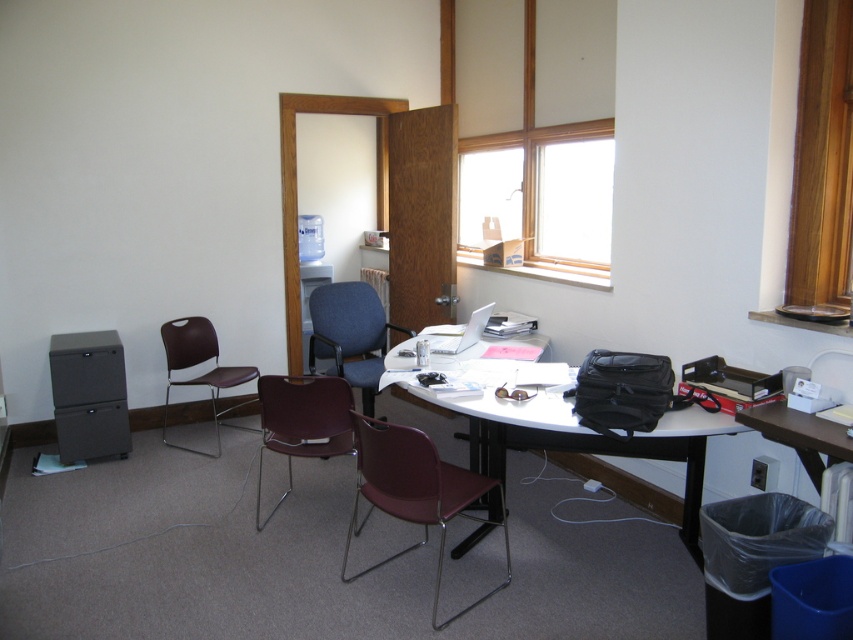
You are standing in the office and want to pick up an item from the table. The item you want is located at point (494, 70). However, there is another item blocking your view at point (335, 333). Will you be able to see the item you want without moving your head?

Point (494, 70) is further to the camera than point (335, 333), so yes, you can see the item at point (494, 70) without moving your head because it is closer to you than the blocking item at point (335, 333).

You are organizing a meeting in the office and need to place a large poster on the wall. The poster is the same size as the wooden frame at upper center. Will it fit on the matte black table at center without overlapping the edges?

The wooden frame at upper center is larger in size than the matte black table at center. Since the poster is the same size as the wooden frame, it will not fit on the matte black table at center without overlapping the edges because the table is smaller than the poster.